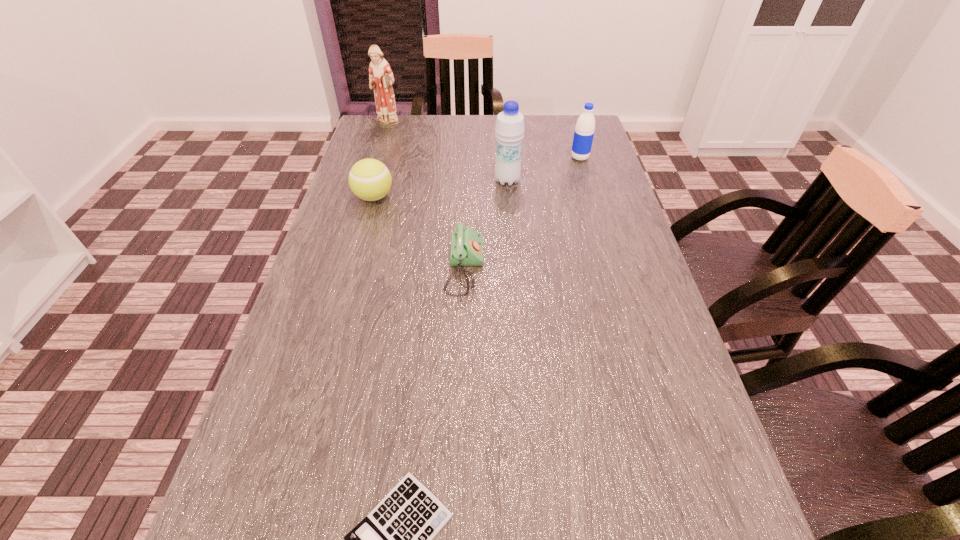
Locate an element on the screen. This screenshot has width=960, height=540. blank space located 0.200m on the back of the fourth shortest object is located at coordinates click(569, 122).

Locate an element on the screen. This screenshot has width=960, height=540. free space located on the front of the tennis ball is located at coordinates coord(341,315).

At what (x,y) coordinates should I click in order to perform the action: click on blank area located on the dial of the second nearest object. Please return your answer as a coordinate pair (x, y). Looking at the image, I should click on (565, 268).

This screenshot has width=960, height=540. In order to click on object that is positioned at the far edge in this screenshot , I will do `click(381, 78)`.

The image size is (960, 540). What are the coordinates of `figurine that is positioned at the left edge` in the screenshot? It's located at (381, 78).

Where is `tennis ball located in the left edge section of the desktop`? tennis ball located in the left edge section of the desktop is located at coordinates (369, 179).

Locate an element on the screen. The width and height of the screenshot is (960, 540). object situated at the right edge is located at coordinates (584, 131).

Find the location of `object at the far left corner`. object at the far left corner is located at coordinates (381, 78).

In the image, there is a desktop. Where is `free space at the far edge`? The image size is (960, 540). free space at the far edge is located at coordinates (493, 136).

Locate an element on the screen. free space at the left edge of the desktop is located at coordinates (312, 382).